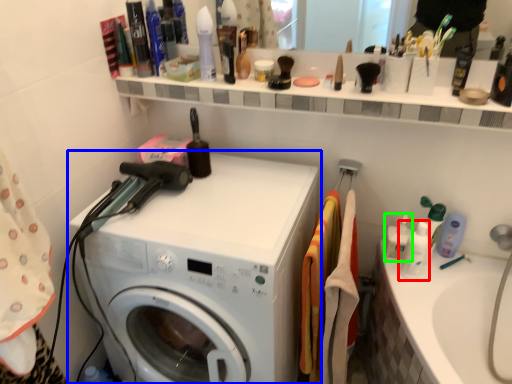
Question: Considering the real-world distances, which object is farthest from toiletry (highlighted by a red box)? washing machine (highlighted by a blue box) or cleaning product (highlighted by a green box)?

Choices:
 (A) washing machine
 (B) cleaning product

Answer: (A)